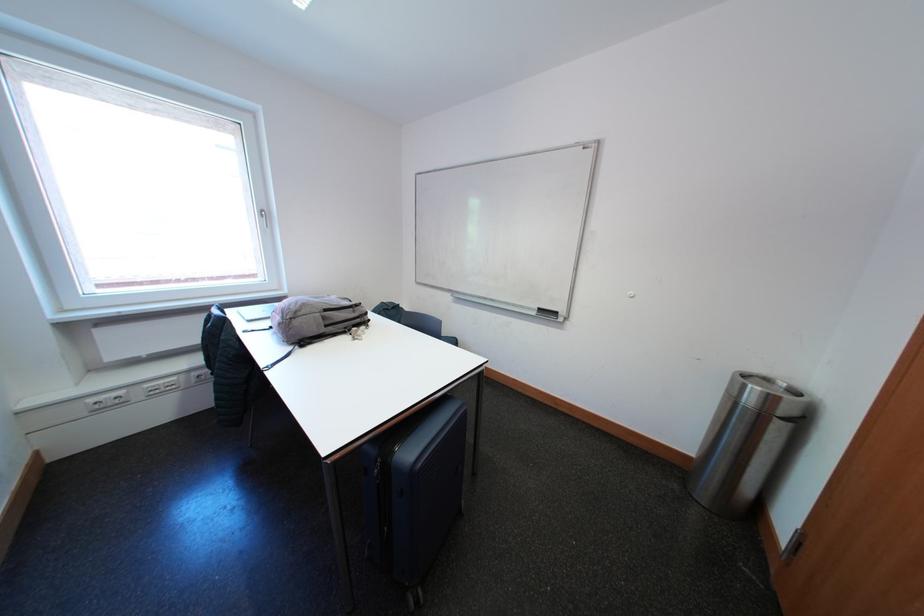
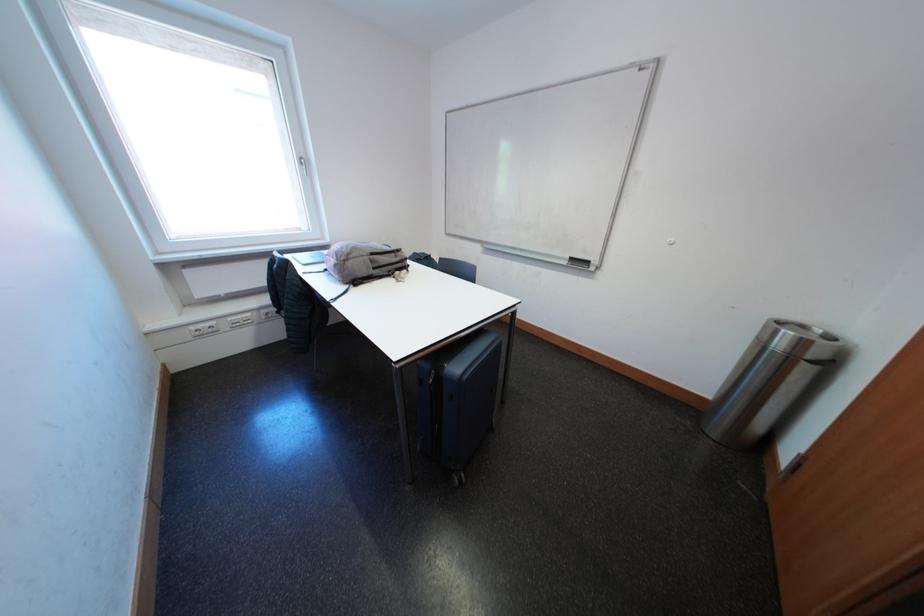
Find the pixel in the second image that matches point 101,403 in the first image.

(202, 331)